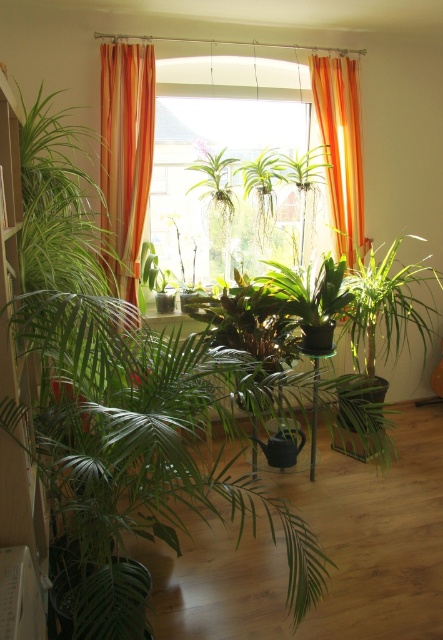
You are standing in the room and want to water the plants on the transparent glass table at center. To reach the black watering can, do you need to move past the orange fabric curtain at center first?

The orange fabric curtain at center is further to the viewer than transparent glass table at center, so you do not need to move past the orange fabric curtain at center first to reach the black watering can on the transparent glass table at center.

You are arranging flowers in the living room and need to place a new vase between the orange fabric curtain at center and the transparent glass table at center. According to the scene description, which object should the vase be placed closer to?

The vase should be placed closer to the transparent glass table at center because the orange fabric curtain at center is to the right of the transparent glass table at center, meaning the table is to the left of the curtain. Therefore, placing the vase between them would require positioning it closer to the table to maintain the existing spatial arrangement.

What is the 2D coordinate of the transparent glass window at center in the image?

The transparent glass window at center is located at the 2D coordinate point of (221, 184).